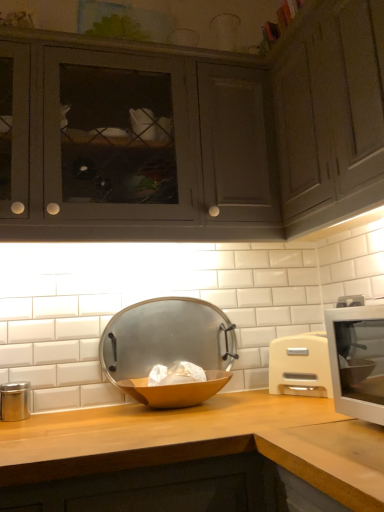
The image size is (384, 512). Find the location of `free space above wooden at center (from a real-world perspective)`. free space above wooden at center (from a real-world perspective) is located at coordinates (98, 418).